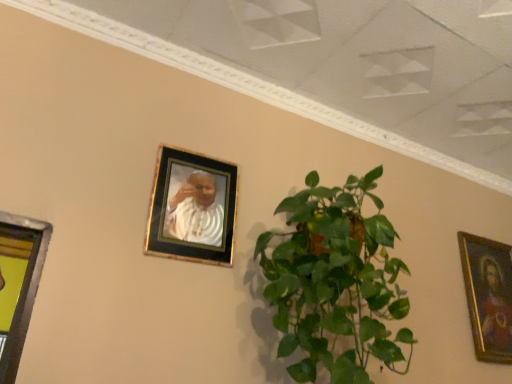
Question: Considering the relative sizes of gold-framed painting at right, positioned as the second picture frame in left-to-right order, and green leafy plant at center in the image provided, is gold-framed painting at right, positioned as the second picture frame in left-to-right order, wider than green leafy plant at center?

Choices:
 (A) no
 (B) yes

Answer: (A)

Question: From a real-world perspective, does gold-framed painting at right, the 2th picture frame when ordered from front to back, stand above green leafy plant at center?

Choices:
 (A) no
 (B) yes

Answer: (B)

Question: Is gold-framed painting at right, arranged as the first picture frame when viewed from the right, facing towards green leafy plant at center?

Choices:
 (A) no
 (B) yes

Answer: (A)

Question: From the image's perspective, would you say gold-framed painting at right, which is the 2th picture frame in top-to-bottom order, is shown under green leafy plant at center?

Choices:
 (A) no
 (B) yes

Answer: (B)

Question: Is gold-framed painting at right, which is the 2th picture frame in top-to-bottom order, turned away from green leafy plant at center?

Choices:
 (A) no
 (B) yes

Answer: (A)

Question: From the image's perspective, is gold-framed painting at right, which is the 2th picture frame in top-to-bottom order, located above or below green leafy plant at center?

Choices:
 (A) below
 (B) above

Answer: (A)

Question: From a real-world perspective, relative to green leafy plant at center, is gold-framed painting at right, positioned as the second picture frame in left-to-right order, vertically above or below?

Choices:
 (A) above
 (B) below

Answer: (A)

Question: Is gold-framed painting at right, arranged as the first picture frame when viewed from the back, to the left or to the right of green leafy plant at center in the image?

Choices:
 (A) right
 (B) left

Answer: (A)

Question: Is gold-framed painting at right, positioned as the second picture frame in left-to-right order, bigger or smaller than green leafy plant at center?

Choices:
 (A) big
 (B) small

Answer: (B)

Question: Visually, is gold-framed photo at upper center, the 2th picture frame positioned from the right, positioned to the left or to the right of green leafy plant at center?

Choices:
 (A) left
 (B) right

Answer: (A)

Question: Is gold-framed photo at upper center, the 2th picture frame positioned from the right, situated inside green leafy plant at center or outside?

Choices:
 (A) inside
 (B) outside

Answer: (B)

Question: Based on their sizes in the image, would you say gold-framed photo at upper center, arranged as the first picture frame when viewed from the top, is bigger or smaller than green leafy plant at center?

Choices:
 (A) big
 (B) small

Answer: (B)

Question: Is point (188, 168) closer or farther from the camera than point (373, 230)?

Choices:
 (A) farther
 (B) closer

Answer: (A)

Question: Which is correct: green leafy plant at center is inside gold-framed photo at upper center, arranged as the first picture frame when viewed from the top, or outside of it?

Choices:
 (A) inside
 (B) outside

Answer: (B)

Question: Based on their sizes in the image, would you say green leafy plant at center is bigger or smaller than gold-framed photo at upper center, the second picture frame positioned from the back?

Choices:
 (A) small
 (B) big

Answer: (B)